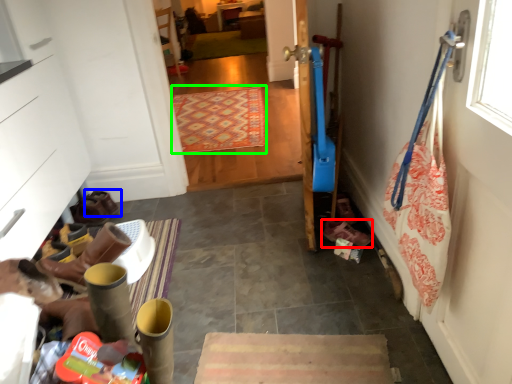
Question: Considering the real-world distances, which object is farthest from footwear (highlighted by a red box)? footwear (highlighted by a blue box) or mat (highlighted by a green box)?

Choices:
 (A) footwear
 (B) mat

Answer: (B)